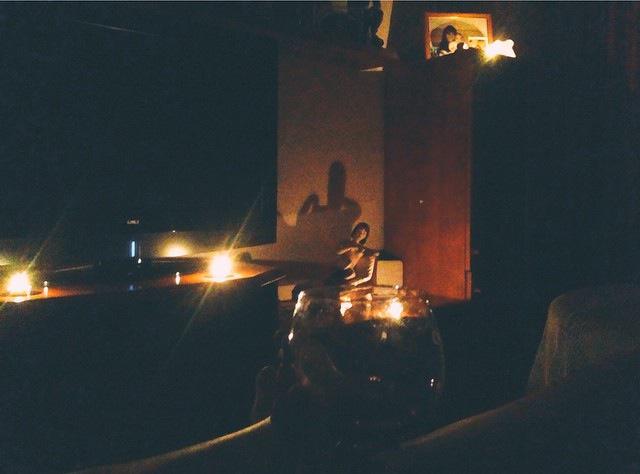
Where is `shadow on the wall`? This screenshot has width=640, height=474. shadow on the wall is located at coordinates (335, 218).